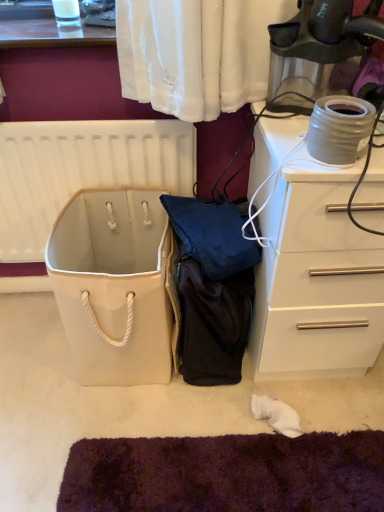
At what (x,y) coordinates should I click in order to perform the action: click on free spot above white plastic radiator at upper left (from a real-world perspective). Please return your answer as a coordinate pair (x, y). Looking at the image, I should click on [x=105, y=117].